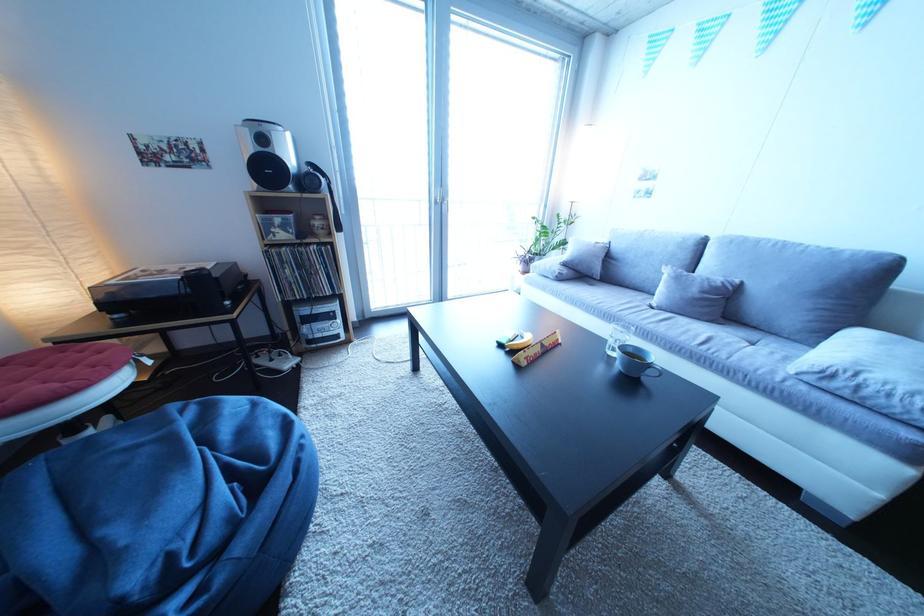
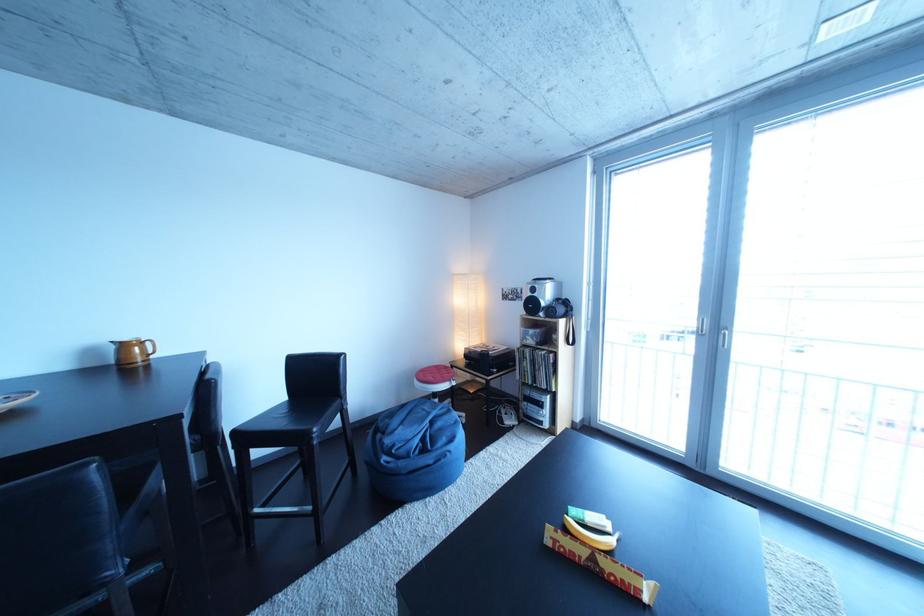
Find the pixel in the second image that matches (x=275, y=146) in the first image.

(545, 296)